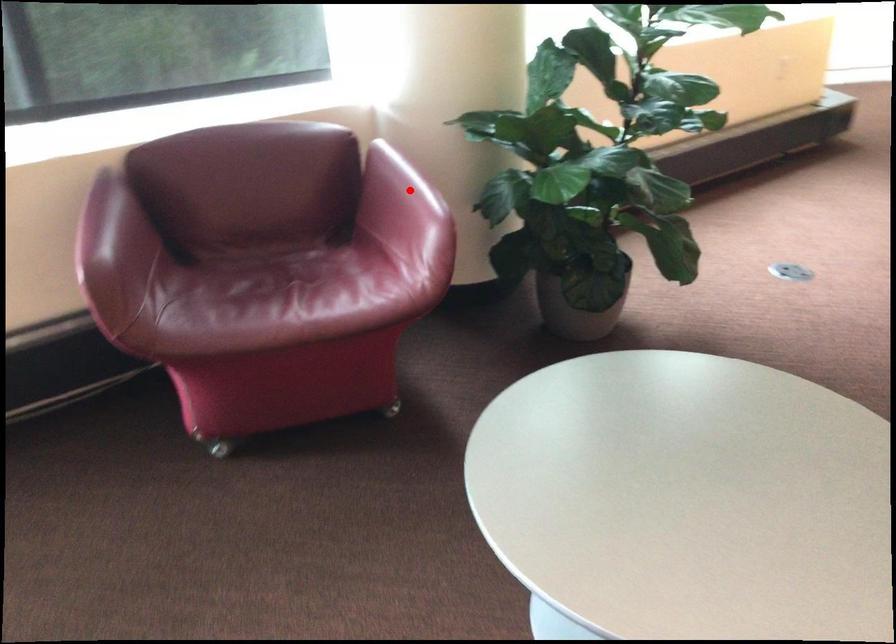
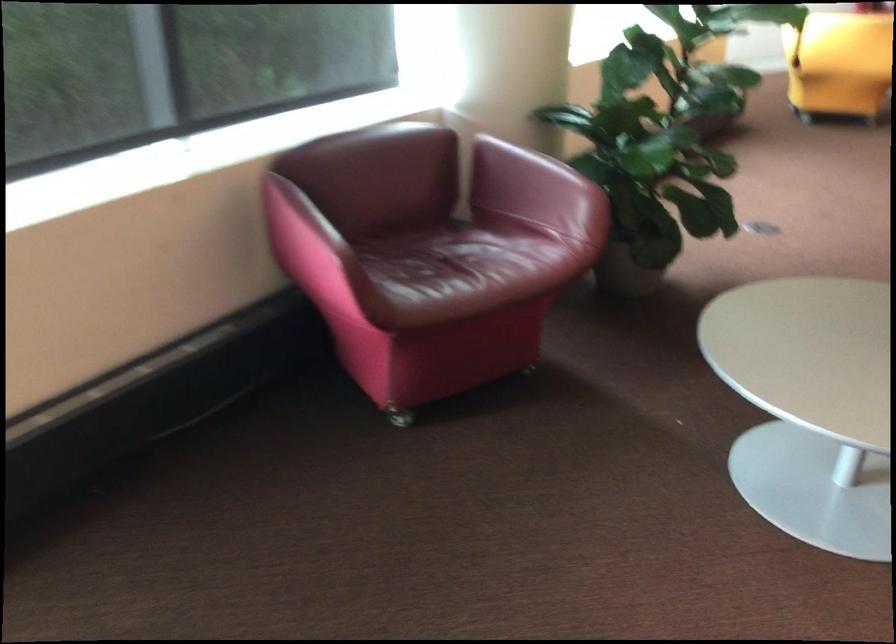
Locate, in the second image, the point that corresponds to the highlighted location in the first image.

(543, 169)